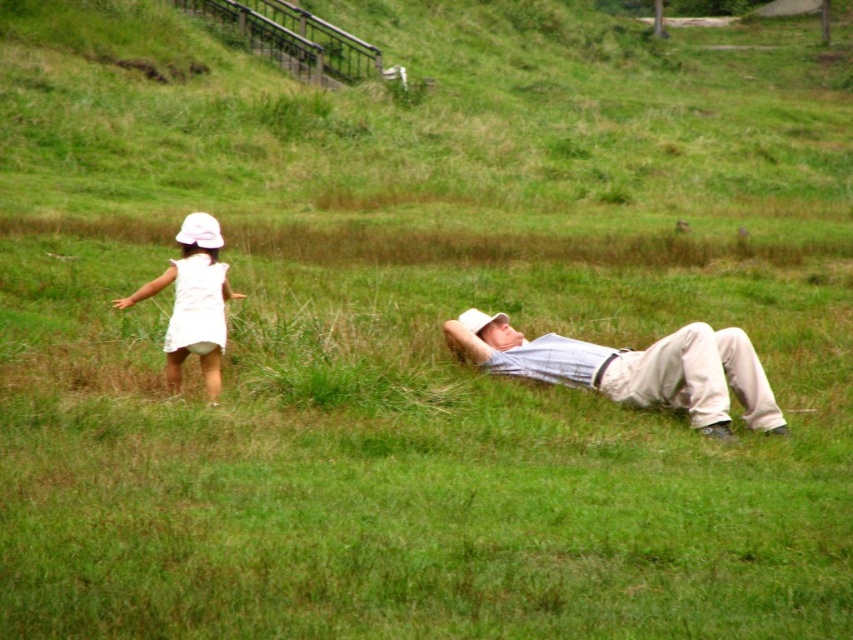
Between light beige cotton pants at lower right and white cotton dress at left, which one is positioned lower?

Positioned lower is light beige cotton pants at lower right.

Is point (627, 364) positioned before point (180, 285)?

No, it is not.

Is point (741, 358) positioned in front of point (175, 280)?

Yes, it is in front of point (175, 280).

Where is `light beige cotton pants at lower right`? The width and height of the screenshot is (853, 640). light beige cotton pants at lower right is located at coordinates (633, 369).